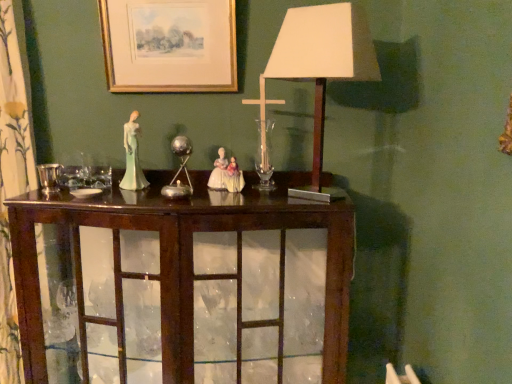
Identify the location of vacant space underneath white paper lampshade at center (from a real-world perspective). (309, 200).